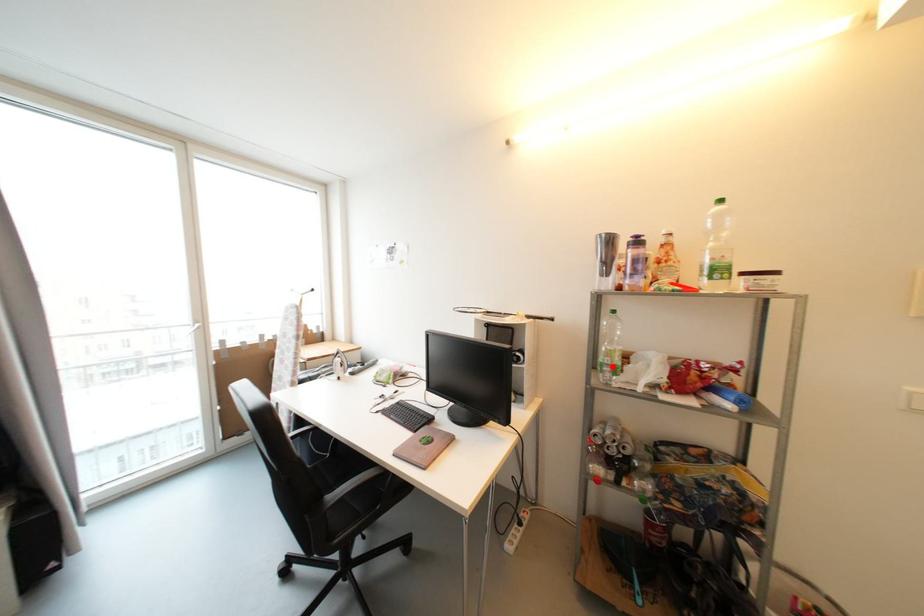
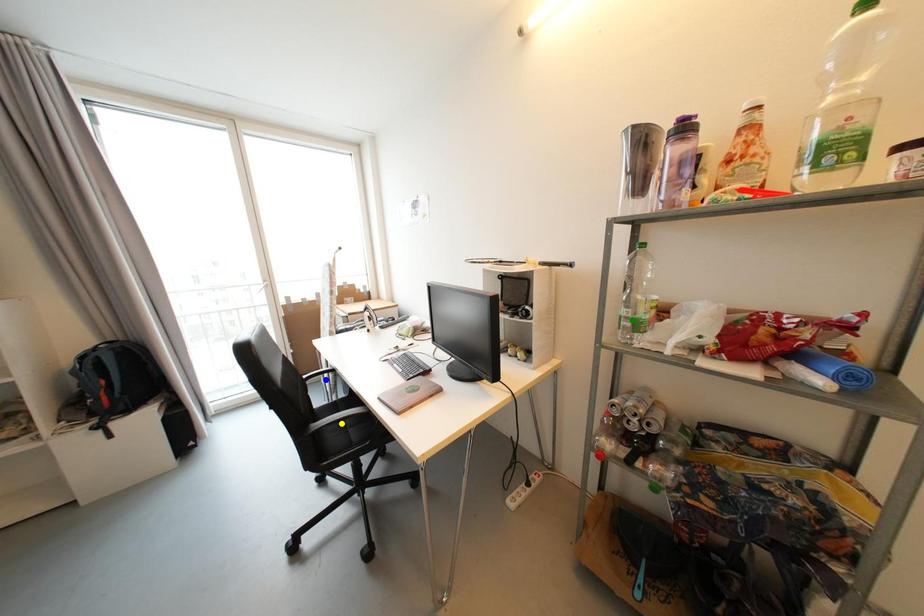
Question: I am providing you with two images of the same scene from different viewpoints. A red point is marked on the first image. You are given multiple points on the second image. Which point in image 2 represents the same 3d spot as the red point in image 1?

Choices:
 (A) blue point
 (B) yellow point
 (C) green point

Answer: (C)